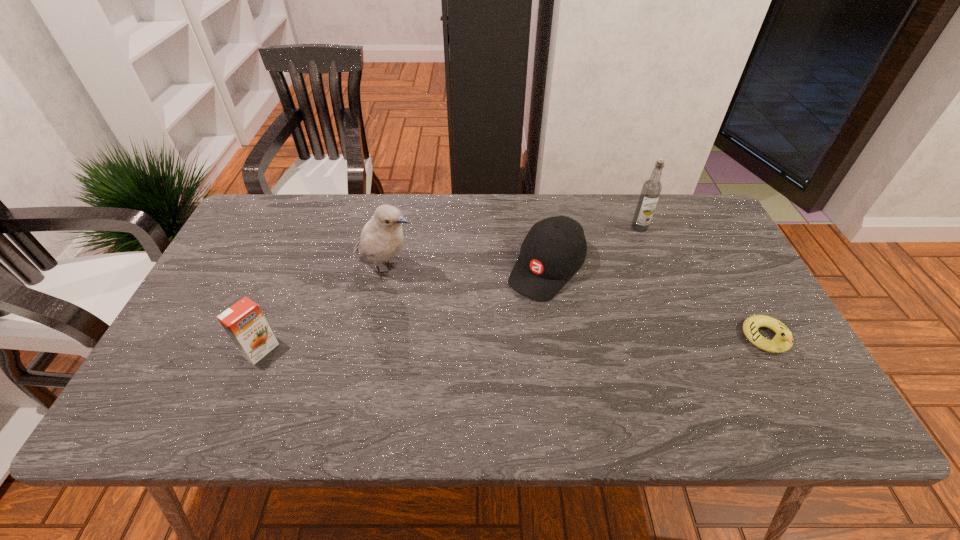
Locate an element on the screen. vacant position located on the label of the farthest object is located at coordinates (576, 305).

This screenshot has width=960, height=540. Find the location of `vacant space located on the label of the farthest object`. vacant space located on the label of the farthest object is located at coordinates (613, 259).

Image resolution: width=960 pixels, height=540 pixels. Find the location of `free space located with a logo on the front of the baseball cap`. free space located with a logo on the front of the baseball cap is located at coordinates pyautogui.click(x=516, y=308).

The height and width of the screenshot is (540, 960). In order to click on vacant space located 0.300m with a logo on the front of the baseball cap in this screenshot , I will do `click(459, 378)`.

In order to click on free space located with a logo on the front of the baseball cap in this screenshot , I will do `click(511, 315)`.

Find the location of a particular element. vacant space located 0.180m at the beak of the bird is located at coordinates (470, 302).

Locate an element on the screen. vacant space situated at the beak of the bird is located at coordinates (494, 313).

Identify the location of vacant space located 0.240m at the beak of the bird. The width and height of the screenshot is (960, 540). (491, 312).

I want to click on vodka at the far edge, so click(651, 189).

Find the location of a particular element. baseball cap present at the far edge is located at coordinates (555, 248).